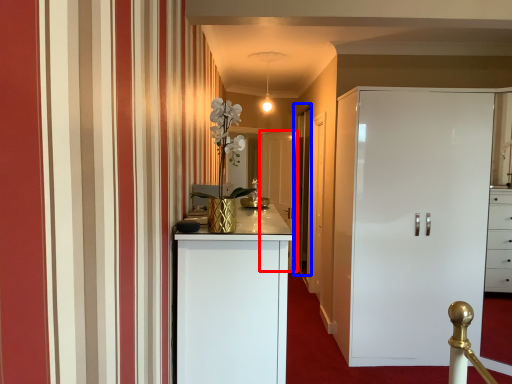
Question: Which point is further to the camera, door (highlighted by a red box) or glass door (highlighted by a blue box)?

Choices:
 (A) door
 (B) glass door

Answer: (A)